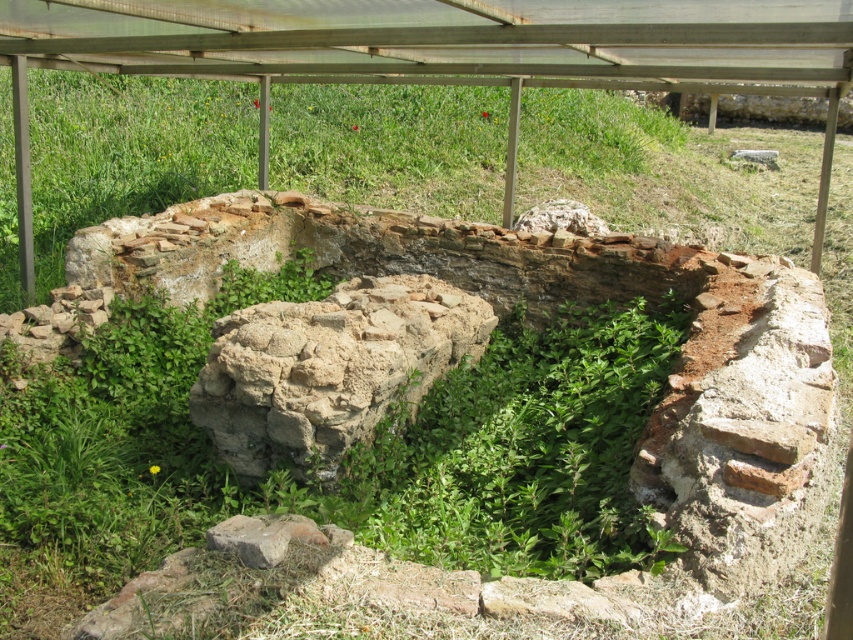
Can you confirm if brown rough stone at center is taller than rusty brick stone at lower left?

Correct, brown rough stone at center is much taller as rusty brick stone at lower left.

Based on the photo, who is lower down, brown rough stone at center or rusty brick stone at lower left?

rusty brick stone at lower left is below.

Between point (296, 403) and point (254, 540), which one is positioned behind?

Positioned behind is point (296, 403).

Locate an element on the screen. The height and width of the screenshot is (640, 853). brown rough stone at center is located at coordinates (329, 368).

Between green leafy weed at center and rusty brick stone at lower left, which one is positioned lower?

rusty brick stone at lower left is lower down.

Is the position of green leafy weed at center more distant than that of rusty brick stone at lower left?

Yes, it is behind rusty brick stone at lower left.

Identify the location of green leafy weed at center. This screenshot has height=640, width=853. (524, 451).

Between green leafy weed at center and brown rough stone at center, which one is positioned higher?

Positioned higher is brown rough stone at center.

Is point (601, 305) positioned behind point (440, 316)?

That is True.

Identify the location of green leafy weed at center. The width and height of the screenshot is (853, 640). (524, 451).